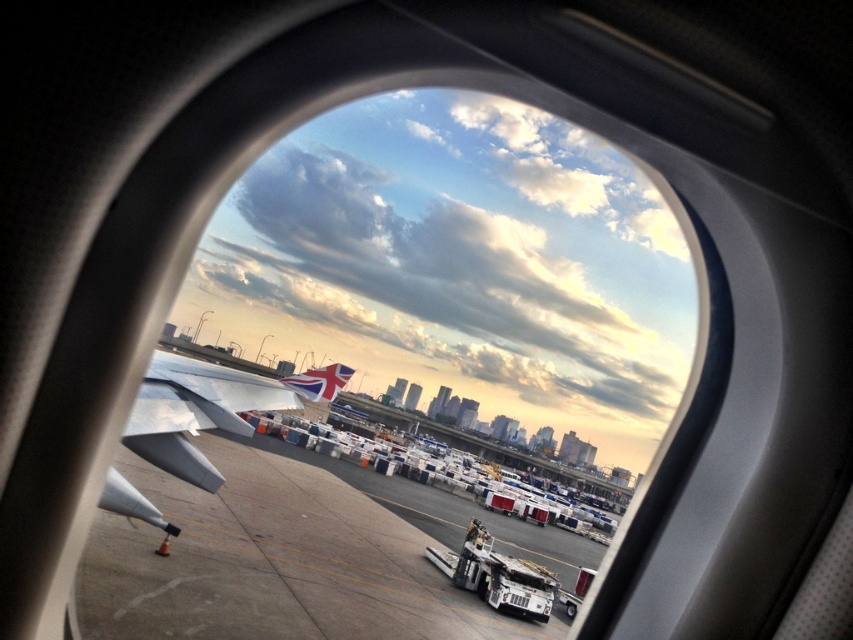
Question: Can you confirm if concrete tarmac at center is thinner than silver metallic wing at lower left?

Choices:
 (A) no
 (B) yes

Answer: (A)

Question: Which object appears farthest from the camera in this image?

Choices:
 (A) silver metallic wing at lower left
 (B) concrete tarmac at center

Answer: (B)

Question: Does concrete tarmac at center have a greater width compared to silver metallic wing at lower left?

Choices:
 (A) no
 (B) yes

Answer: (B)

Question: Which of the following is the closest to the observer?

Choices:
 (A) silver metallic wing at lower left
 (B) concrete tarmac at center

Answer: (A)

Question: Observing the image, what is the correct spatial positioning of concrete tarmac at center in reference to silver metallic wing at lower left?

Choices:
 (A) below
 (B) above

Answer: (A)